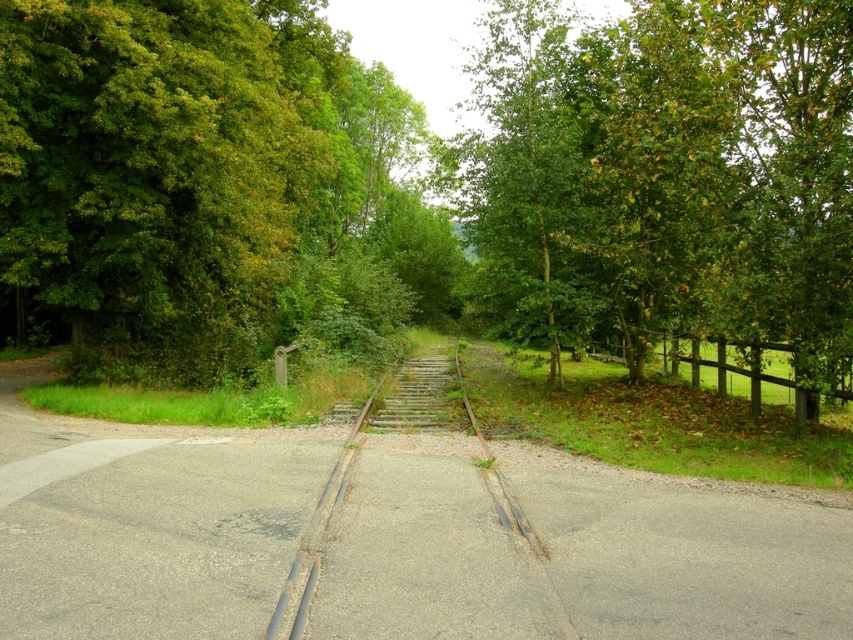
You are a hiker standing at the intersection of the road and the railway tracks. You notice a green leafy tree at upper right and a rusty metal train track at center. Which object is located to the right of the other?

The green leafy tree at upper right is positioned on the right side of the rusty metal train track at center.

Based on the photo, you are standing at the intersection of the road and the railway tracks. You see a green leafy tree at center and a rusty metal train track at center. Which object is located to the left when facing the tracks?

The green leafy tree at center is positioned on the left side of the rusty metal train track at center, so it is to the left when facing the tracks.